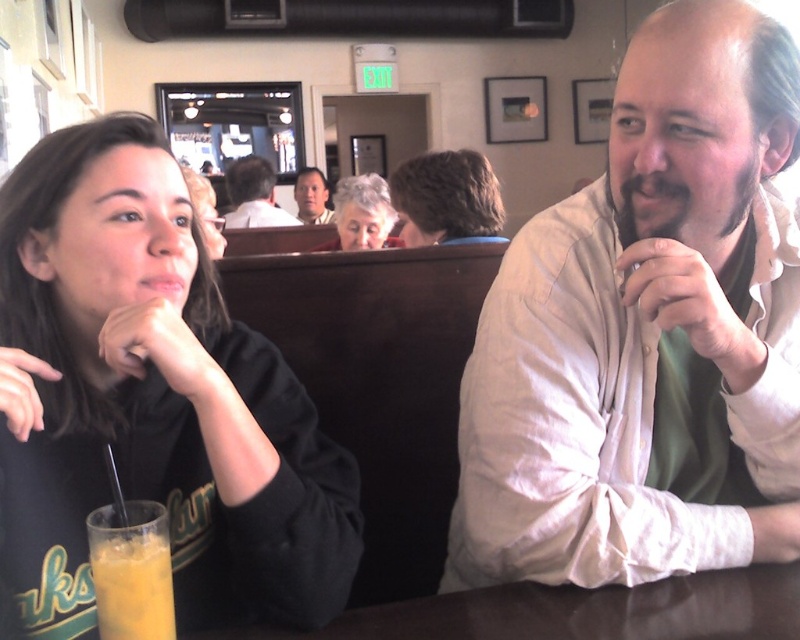
Question: Based on their relative distances, which object is nearer to the gray hair at center?

Choices:
 (A) curly brown hair at center
 (B) white cotton shirt at center
 (C) matte black hair at upper center
 (D) black matte shirt at left

Answer: (A)

Question: Is matte black shirt at center bigger than matte black hair at upper center?

Choices:
 (A) yes
 (B) no

Answer: (A)

Question: Is dark brown polished wood table at lower center smaller than curly brown hair at center?

Choices:
 (A) yes
 (B) no

Answer: (A)

Question: Which object appears farthest from the camera in this image?

Choices:
 (A) matte black hair at upper center
 (B) black matte shirt at left

Answer: (A)

Question: Does dark brown polished wood table at lower center have a greater width compared to gray hair at center?

Choices:
 (A) no
 (B) yes

Answer: (B)

Question: Considering the real-world distances, which object is closest to the black matte shirt at left?

Choices:
 (A) matte black hair at upper center
 (B) dark brown polished wood table at lower center

Answer: (B)